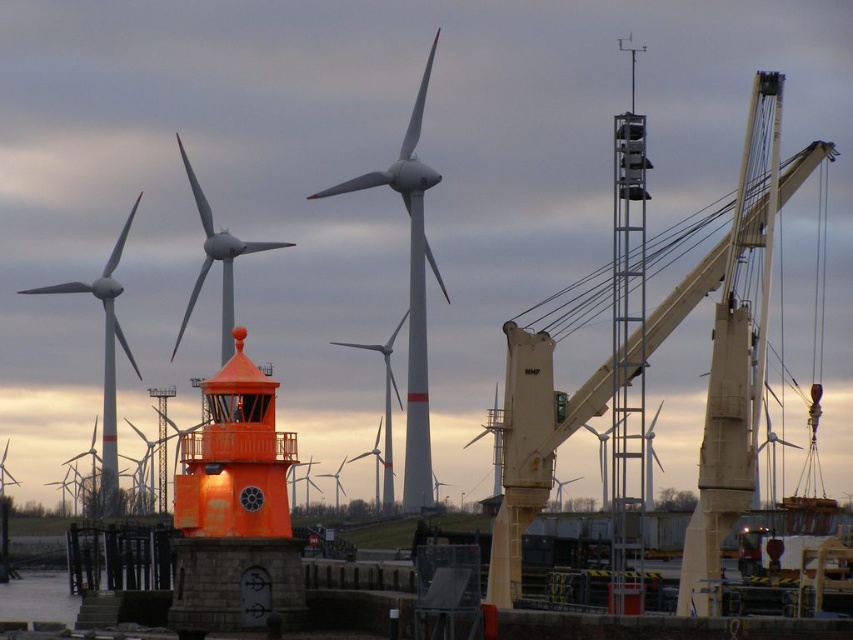
Question: Which of the following is the farthest from the observer?

Choices:
 (A) (495, 522)
 (B) (106, 280)
 (C) (422, 218)

Answer: (B)

Question: Which point is farther from the camera taking this photo?

Choices:
 (A) (498, 548)
 (B) (109, 486)

Answer: (B)

Question: Among these points, which one is farthest from the camera?

Choices:
 (A) (109, 301)
 (B) (408, 376)

Answer: (A)

Question: Can you confirm if white matte wind turbine at center is positioned to the left of white matte windmill at left?

Choices:
 (A) yes
 (B) no

Answer: (B)

Question: Does beige metallic crane at right lie behind white matte wind turbine at center?

Choices:
 (A) yes
 (B) no

Answer: (B)

Question: Does beige metallic crane at right appear on the left side of white matte windmill at left?

Choices:
 (A) yes
 (B) no

Answer: (B)